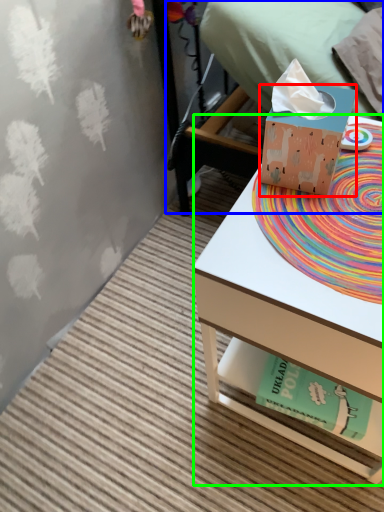
Question: Which is farther away from box (highlighted by a red box)? bed (highlighted by a blue box) or desk (highlighted by a green box)?

Choices:
 (A) bed
 (B) desk

Answer: (A)